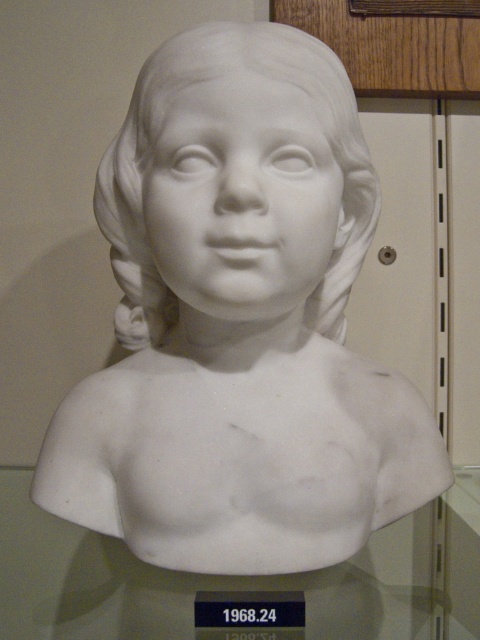
You are an art conservator examining two busts in a museum. You have a transparent glass bust at center and a white marble bust at center. Which one has a greater width?

The transparent glass bust at center has a greater width than the white marble bust at center according to the description.

You are a visitor in the museum standing in front of the marble bust of the young girl. You notice two points marked on the wall behind the sculpture. The first point is at coordinates point (455, 628) and the second point is at point (311, 317). If you were to draw a straight line from your eyes to each point, which point would you see closer to the sculpture?

Point (455, 628) is in front of point (311, 317), so you would see point (455, 628) closer to the sculpture.